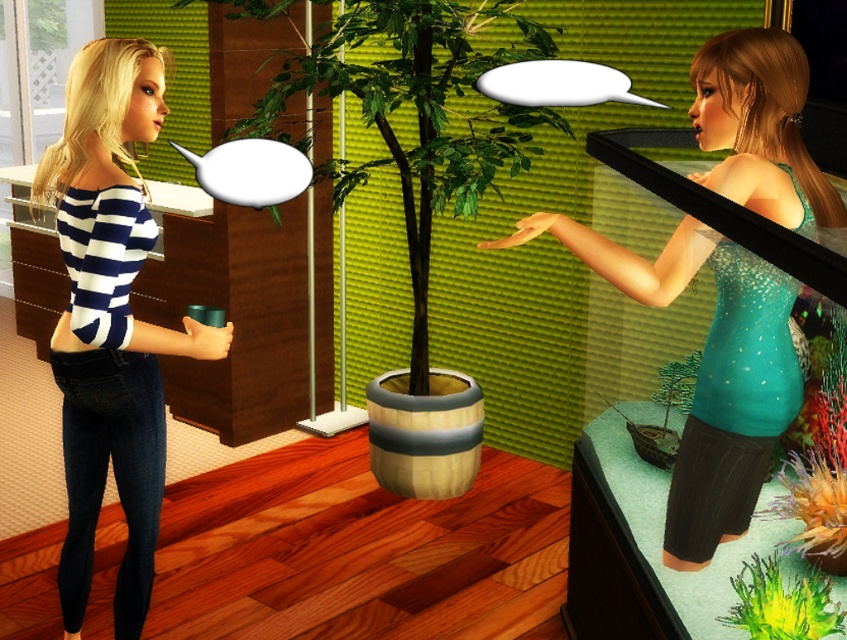
You are a delivery person who needs to place a small package between the teal glitter tank top at center and the green matte plant at center. Can you fit it there?

The teal glitter tank top at center and green matte plant at center are 19.67 inches apart, so yes, the small package can be placed between them as there is enough space.

You are a photographer planning to take a portrait of both the teal glitter tank top at center and the green matte plant at center. To ensure both are in focus, you need to know their vertical positions. Based on the scene, which object is higher up?

The teal glitter tank top at center is above the green matte plant at center, so it is higher up.